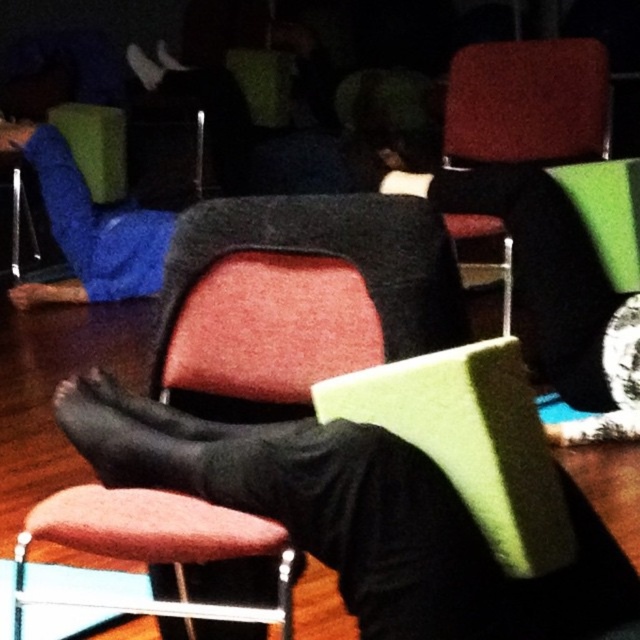
You are standing in the room and want to walk from point (160,480) to point (474,157). Which direction should you face to move towards the farther point?

You should face towards the direction of point (474,157) since it is farther from the viewer compared to point (160,480).